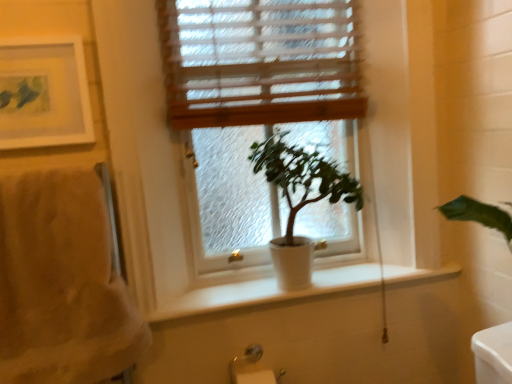
Locate an element on the screen. wooden blinds at upper center is located at coordinates (260, 62).

Who is taller, white matte window at center or silver metallic towel bar at lower left?

white matte window at center is taller.

Is white matte window at center not within silver metallic towel bar at lower left?

white matte window at center lies outside silver metallic towel bar at lower left's area.

From the image's perspective, relative to silver metallic towel bar at lower left, is white matte window at center above or below?

Clearly, from the image's perspective, white matte window at center is above silver metallic towel bar at lower left.

Would you consider silver metallic towel bar at lower left to be distant from matte white picture frame at upper left?

They are positioned close to each other.

Which object is thinner, silver metallic towel bar at lower left or matte white picture frame at upper left?

With smaller width is matte white picture frame at upper left.

Could you tell me if silver metallic towel bar at lower left is turned towards matte white picture frame at upper left?

No, silver metallic towel bar at lower left is not turned towards matte white picture frame at upper left.

Looking at this image, based on their positions, is silver metallic towel bar at lower left located to the left or right of matte white picture frame at upper left?

silver metallic towel bar at lower left is to the right of matte white picture frame at upper left.

Who is smaller, green matte plant at center or wooden blinds at upper center?

With smaller size is wooden blinds at upper center.

From the image's perspective, is green matte plant at center beneath wooden blinds at upper center?

Indeed, from the image's perspective, green matte plant at center is shown beneath wooden blinds at upper center.

Is green matte plant at center closer to the viewer compared to wooden blinds at upper center?

No.

At what (x,y) coordinates should I click in order to perform the action: click on window blind that is on the left side of green matte plant at center. Please return your answer as a coordinate pair (x, y). The height and width of the screenshot is (384, 512). Looking at the image, I should click on (260, 62).

Is wooden blinds at upper center to the left of beige fluffy towel at left from the viewer's perspective?

No.

In the scene shown: Is wooden blinds at upper center far from beige fluffy towel at left?

No, wooden blinds at upper center is in close proximity to beige fluffy towel at left.

From their relative heights in the image, would you say wooden blinds at upper center is taller or shorter than beige fluffy towel at left?

wooden blinds at upper center is shorter than beige fluffy towel at left.

Which is in front, point (327, 51) or point (111, 315)?

The point (111, 315) is closer to the camera.

Is green matte plant at center facing away from matte white picture frame at upper left?

green matte plant at center does not have its back to matte white picture frame at upper left.

Is green matte plant at center wider than matte white picture frame at upper left?

Indeed, green matte plant at center has a greater width compared to matte white picture frame at upper left.

Based on the photo, considering the positions of objects green matte plant at center and matte white picture frame at upper left in the image provided, who is behind, green matte plant at center or matte white picture frame at upper left?

green matte plant at center.

Is green matte plant at center inside or outside of matte white picture frame at upper left?

green matte plant at center cannot be found inside matte white picture frame at upper left.

Is white matte window at center far away from beige fluffy towel at left?

No, white matte window at center is in close proximity to beige fluffy towel at left.

From a real-world perspective, is white matte window at center positioned under beige fluffy towel at left based on gravity?

No, from a real-world perspective, white matte window at center is not beneath beige fluffy towel at left.

Consider the image. Who is more distant, white matte window at center or beige fluffy towel at left?

white matte window at center is further from the camera.

Does point (241, 88) come farther from viewer compared to point (51, 314)?

That is True.

What's the angular difference between matte white picture frame at upper left and wooden blinds at upper center's facing directions?

matte white picture frame at upper left and wooden blinds at upper center are facing 0.6 degrees away from each other.

Is point (75, 95) positioned in front of point (210, 99)?

Yes.

Is matte white picture frame at upper left turned away from wooden blinds at upper center?

No, matte white picture frame at upper left's orientation is not away from wooden blinds at upper center.

Considering the relative sizes of matte white picture frame at upper left and wooden blinds at upper center in the image provided, is matte white picture frame at upper left shorter than wooden blinds at upper center?

Yes.

Image resolution: width=512 pixels, height=384 pixels. In order to click on window in front of the silver metallic towel bar at lower left in this screenshot , I will do (x=259, y=62).

At what (x,y) coordinates should I click in order to perform the action: click on picture frame above the silver metallic towel bar at lower left (from the image's perspective). Please return your answer as a coordinate pair (x, y). Looking at the image, I should click on (42, 93).

Which object lies further to the anchor point white matte window at center, matte white picture frame at upper left or silver metallic towel bar at lower left?

silver metallic towel bar at lower left lies further to white matte window at center than the other object.

Looking at this image, considering their positions, is silver metallic towel bar at lower left positioned closer to green matte plant at center than white matte window at center?

white matte window at center is positioned closer to the anchor green matte plant at center.

Based on their spatial positions, is matte white picture frame at upper left or green matte plant at center further from silver metallic towel bar at lower left?

The object further to silver metallic towel bar at lower left is matte white picture frame at upper left.

Considering their positions, is silver metallic towel bar at lower left positioned closer to wooden blinds at upper center than matte white picture frame at upper left?

matte white picture frame at upper left lies closer to wooden blinds at upper center than the other object.

When comparing their distances from green matte plant at center, does wooden blinds at upper center or silver metallic towel bar at lower left seem further?

silver metallic towel bar at lower left lies further to green matte plant at center than the other object.

Consider the image. Looking at the image, which one is located further to white matte window at center, silver metallic towel bar at lower left or matte white picture frame at upper left?

silver metallic towel bar at lower left is positioned further to the anchor white matte window at center.

Estimate the real-world distances between objects in this image. Which object is further from beige fluffy towel at left, silver metallic towel bar at lower left or green matte plant at center?

green matte plant at center.

Which object lies nearer to the anchor point green matte plant at center, beige fluffy towel at left or white matte window at center?

white matte window at center.

The height and width of the screenshot is (384, 512). In order to click on bath towel between matte white picture frame at upper left and silver metallic towel bar at lower left in the up-down direction in this screenshot , I will do `click(61, 283)`.

The image size is (512, 384). I want to click on window between wooden blinds at upper center and beige fluffy towel at left vertically, so click(259, 62).

You are a GUI agent. You are given a task and a screenshot of the screen. Output one action in this format:
    pyautogui.click(x=<x>, y=<y>)
    Task: Click on the bath towel between wooden blinds at upper center and silver metallic towel bar at lower left in the vertical direction
    
    Given the screenshot: What is the action you would take?
    [x=61, y=283]

The height and width of the screenshot is (384, 512). In order to click on houseplant between wooden blinds at upper center and silver metallic towel bar at lower left from top to bottom in this screenshot , I will do `click(300, 201)`.